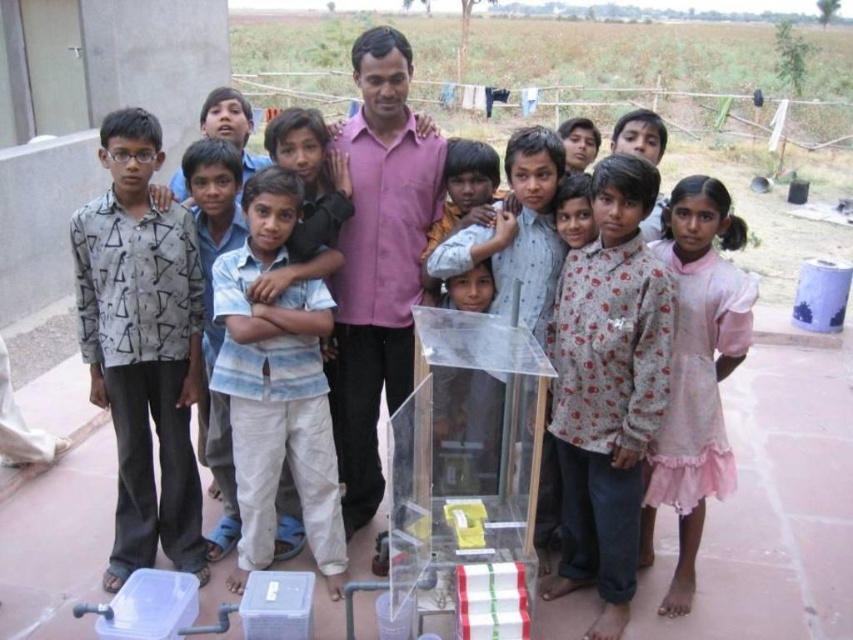
You are a photographer trying to capture a group photo of the children. You notice the blue striped shirt at center and the light brown fabric shirt at center. Which child should you ask to stand on a small stool to ensure both are visible in the photo?

The light brown fabric shirt at center is shorter than the blue striped shirt at center, so you should ask the child wearing the light brown fabric shirt at center to stand on a small stool to ensure both are visible in the photo.